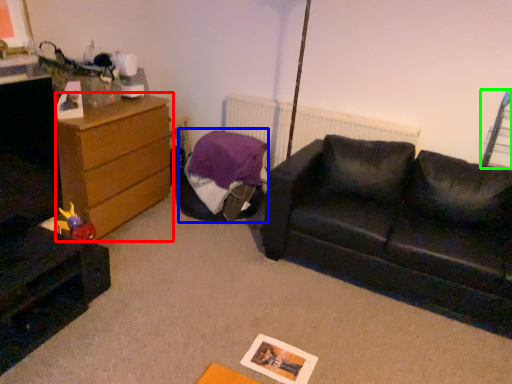
Question: Estimate the real-world distances between objects in this image. Which object is farther from chest of drawers (highlighted by a red box), bean bag chair (highlighted by a blue box) or swivel chair (highlighted by a green box)?

Choices:
 (A) bean bag chair
 (B) swivel chair

Answer: (B)